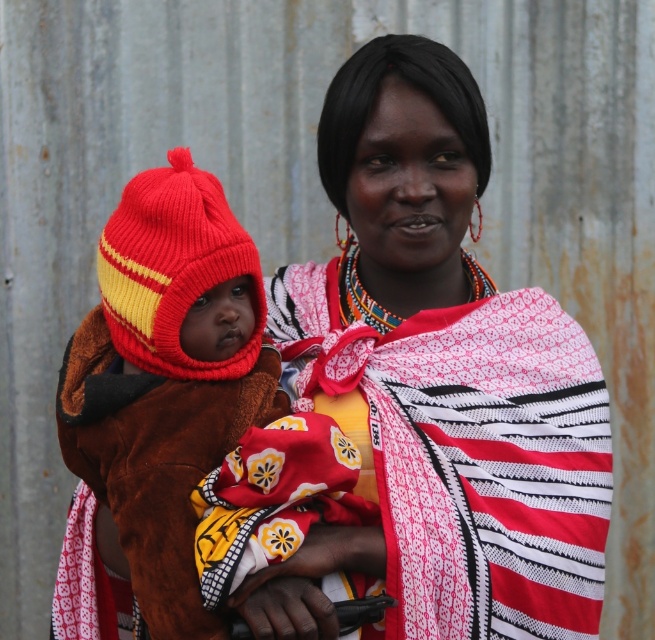
Question: Does knitted woolen hat at left appear over knitted/red/yellow hat at left?

Choices:
 (A) yes
 (B) no

Answer: (B)

Question: Which of the following is the farthest from the observer?

Choices:
 (A) knitted/red/yellow hat at left
 (B) knitted woolen hat at left

Answer: (A)

Question: Estimate the real-world distances between objects in this image. Which object is farther from the knitted woolen hat at left?

Choices:
 (A) knitted fabric shawl at center
 (B) knitted/red/yellow hat at left

Answer: (A)

Question: Can you confirm if knitted fabric shawl at center is positioned to the left of knitted woolen hat at left?

Choices:
 (A) no
 (B) yes

Answer: (A)

Question: Which point is closer to the camera?

Choices:
 (A) (88, 454)
 (B) (183, 353)

Answer: (B)

Question: Observing the image, what is the correct spatial positioning of knitted fabric shawl at center in reference to knitted/red/yellow hat at left?

Choices:
 (A) left
 (B) right

Answer: (B)